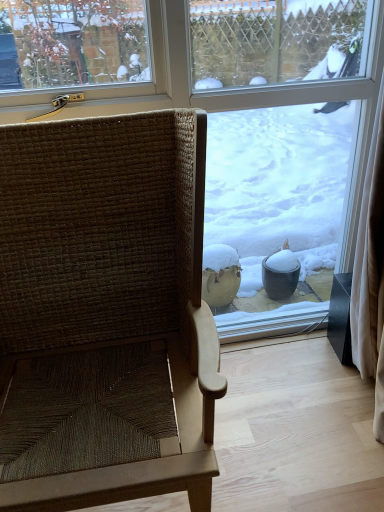
Question: Is woven brown chair at left oriented away from transparent glass window at center?

Choices:
 (A) yes
 (B) no

Answer: (A)

Question: Considering the relative sizes of woven brown chair at left and transparent glass window at center in the image provided, is woven brown chair at left taller than transparent glass window at center?

Choices:
 (A) no
 (B) yes

Answer: (A)

Question: Is woven brown chair at left further to camera compared to transparent glass window at center?

Choices:
 (A) yes
 (B) no

Answer: (B)

Question: Can you confirm if woven brown chair at left is smaller than transparent glass window at center?

Choices:
 (A) yes
 (B) no

Answer: (B)

Question: From a real-world perspective, is woven brown chair at left positioned over transparent glass window at center based on gravity?

Choices:
 (A) no
 (B) yes

Answer: (A)

Question: Is woven brown chair at left shorter than transparent glass window at center?

Choices:
 (A) yes
 (B) no

Answer: (A)

Question: From the image's perspective, is transparent glass window at center located beneath woven brown chair at left?

Choices:
 (A) no
 (B) yes

Answer: (A)

Question: Are transparent glass window at center and woven brown chair at left beside each other?

Choices:
 (A) yes
 (B) no

Answer: (B)

Question: Can you confirm if transparent glass window at center is shorter than woven brown chair at left?

Choices:
 (A) no
 (B) yes

Answer: (A)

Question: Could woven brown chair at left be considered to be inside transparent glass window at center?

Choices:
 (A) no
 (B) yes

Answer: (A)

Question: Can we say transparent glass window at center lies outside woven brown chair at left?

Choices:
 (A) no
 (B) yes

Answer: (B)

Question: Is transparent glass window at center bigger than woven brown chair at left?

Choices:
 (A) no
 (B) yes

Answer: (A)

Question: From a real-world perspective, is transparent glass window at center above or below woven brown chair at left?

Choices:
 (A) below
 (B) above

Answer: (B)